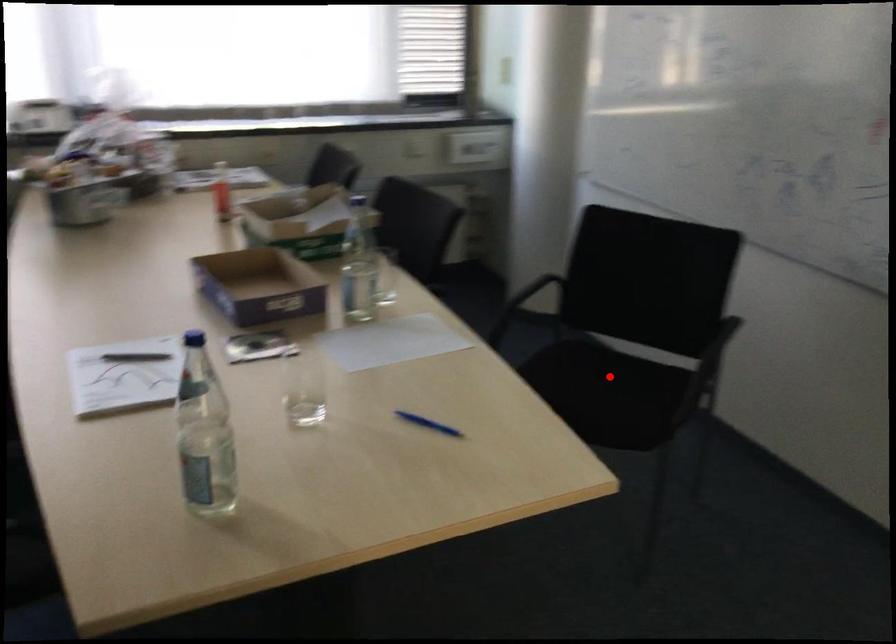
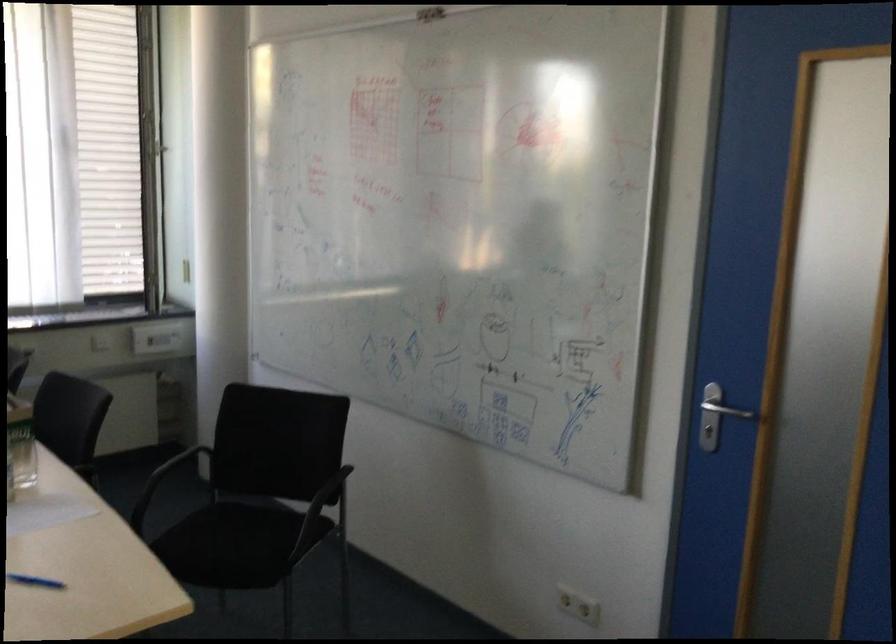
Question: I am providing you with two images of the same scene from different viewpoints. In image1, a red point is highlighted. Considering the same 3D point in image2, which of the following is correct?

Choices:
 (A) It is closer
 (B) It is farther

Answer: (B)